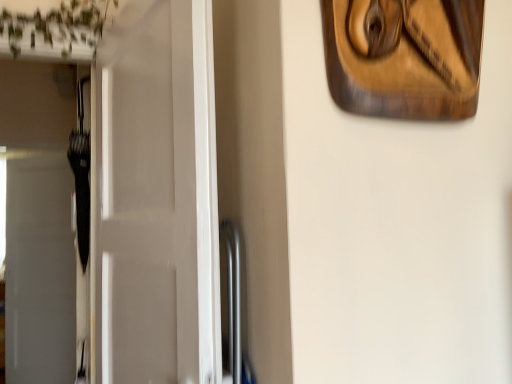
Question: Is wooden carving at upper right at the left side of white glossy door at left?

Choices:
 (A) yes
 (B) no

Answer: (B)

Question: Does wooden carving at upper right have a smaller size compared to white glossy door at left?

Choices:
 (A) no
 (B) yes

Answer: (B)

Question: Can you confirm if wooden carving at upper right is bigger than white glossy door at left?

Choices:
 (A) no
 (B) yes

Answer: (A)

Question: From the image's perspective, is wooden carving at upper right located above white glossy door at left?

Choices:
 (A) yes
 (B) no

Answer: (A)

Question: From a real-world perspective, is wooden carving at upper right located beneath white glossy door at left?

Choices:
 (A) no
 (B) yes

Answer: (A)

Question: Does wooden carving at upper right lie in front of white glossy door at left?

Choices:
 (A) yes
 (B) no

Answer: (A)

Question: Can you confirm if white glossy door at left is positioned to the right of wooden carving at upper right?

Choices:
 (A) no
 (B) yes

Answer: (A)

Question: Does white glossy door at left have a larger size compared to wooden carving at upper right?

Choices:
 (A) no
 (B) yes

Answer: (B)

Question: Can you confirm if white glossy door at left is positioned to the left of wooden carving at upper right?

Choices:
 (A) no
 (B) yes

Answer: (B)

Question: From the image's perspective, is white glossy door at left over wooden carving at upper right?

Choices:
 (A) no
 (B) yes

Answer: (A)

Question: From a real-world perspective, is white glossy door at left located beneath wooden carving at upper right?

Choices:
 (A) no
 (B) yes

Answer: (B)

Question: Is white glossy door at left outside wooden carving at upper right?

Choices:
 (A) yes
 (B) no

Answer: (A)

Question: Is wooden carving at upper right wider or thinner than white glossy door at left?

Choices:
 (A) thin
 (B) wide

Answer: (A)